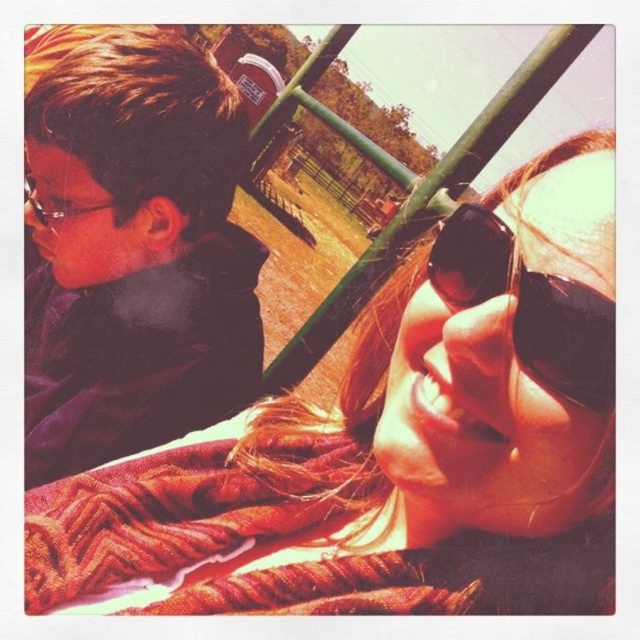
Can you confirm if knitted wool scarf at lower center is shorter than black reflective sunglasses at upper right?

No.

Which of these two, knitted wool scarf at lower center or black reflective sunglasses at upper right, stands shorter?

Standing shorter between the two is black reflective sunglasses at upper right.

The width and height of the screenshot is (640, 640). Find the location of `knitted wool scarf at lower center`. knitted wool scarf at lower center is located at coordinates (284, 544).

This screenshot has width=640, height=640. What do you see at coordinates (392, 445) in the screenshot?
I see `textured orange blanket at lower left` at bounding box center [392, 445].

Between point (600, 208) and point (545, 360), which one is positioned in front?

Point (545, 360)

Find the location of a particular element. This screenshot has width=640, height=640. textured orange blanket at lower left is located at coordinates (392, 445).

At what (x,y) coordinates should I click in order to perform the action: click on textured orange blanket at lower left. Please return your answer as a coordinate pair (x, y). The height and width of the screenshot is (640, 640). Looking at the image, I should click on (392, 445).

How far apart are matte black jacket at left and knitted wool scarf at lower center?

matte black jacket at left and knitted wool scarf at lower center are 61.34 centimeters apart.

Is matte black jacket at left bigger than knitted wool scarf at lower center?

Yes, matte black jacket at left is bigger than knitted wool scarf at lower center.

What do you see at coordinates (132, 248) in the screenshot? I see `matte black jacket at left` at bounding box center [132, 248].

The width and height of the screenshot is (640, 640). In order to click on matte black jacket at left in this screenshot , I will do `click(132, 248)`.